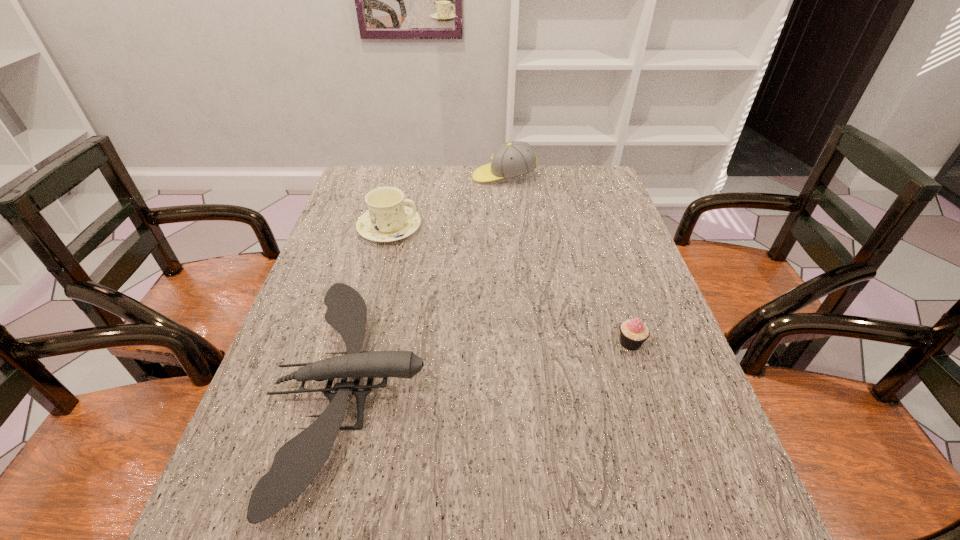
Find the location of a particular element. free space at the right edge of the desktop is located at coordinates (628, 357).

What are the coordinates of `blank space at the far left corner of the desktop` in the screenshot? It's located at (364, 191).

Find the location of a particular element. free space between the rightmost object and the farthest object is located at coordinates (567, 260).

The image size is (960, 540). Identify the location of unoccupied area between the drone and the second object from right to left. (428, 282).

The height and width of the screenshot is (540, 960). What are the coordinates of `empty space between the cupcake and the second object from right to left` in the screenshot? It's located at (567, 260).

Find the location of a particular element. vacant region between the drone and the third nearest object is located at coordinates (371, 308).

This screenshot has height=540, width=960. Identify the location of vacant area that lies between the second farthest object and the shortest object. (510, 285).

The width and height of the screenshot is (960, 540). I want to click on vacant space that's between the second object from right to left and the drone, so click(x=428, y=282).

This screenshot has width=960, height=540. In order to click on blank region between the farthest object and the shortest object in this screenshot , I will do `click(567, 260)`.

This screenshot has height=540, width=960. I want to click on free space between the farthest object and the chinaware, so click(446, 202).